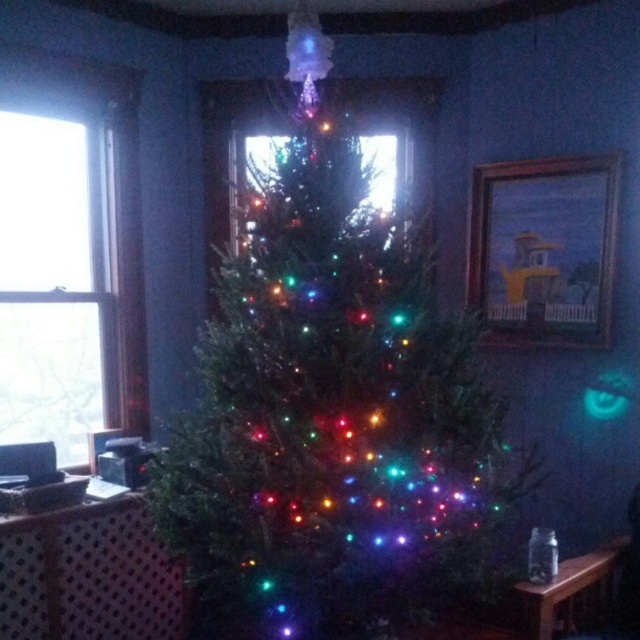
Describe the element at coordinates (332, 406) in the screenshot. I see `iridescent plastic christmas tree at center` at that location.

Does iridescent plastic christmas tree at center have a lesser width compared to transparent glass window at left?

No.

You are a GUI agent. You are given a task and a screenshot of the screen. Output one action in this format:
    pyautogui.click(x=<x>, y=<y>)
    Task: Click on the iridescent plastic christmas tree at center
    The width and height of the screenshot is (640, 640).
    Given the screenshot: What is the action you would take?
    pyautogui.click(x=332, y=406)